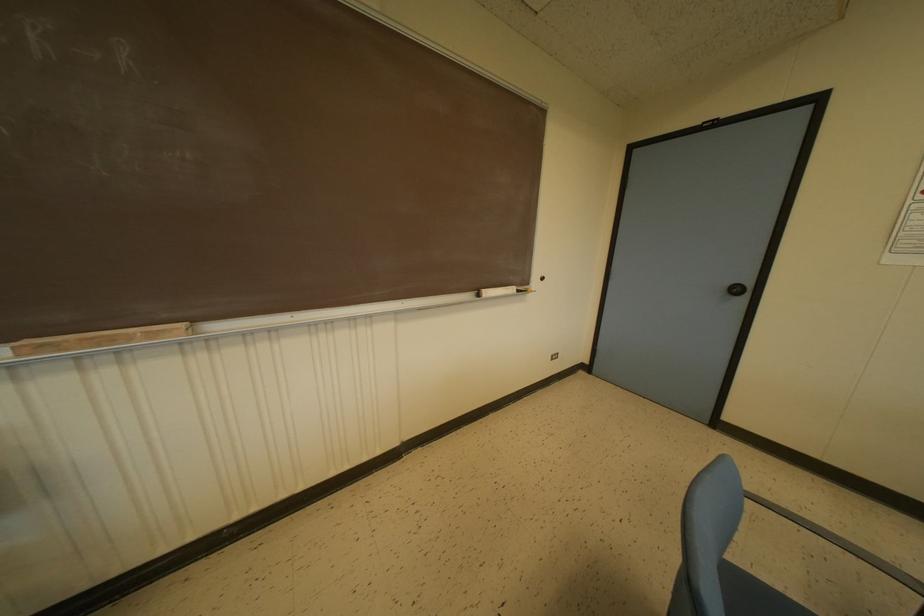
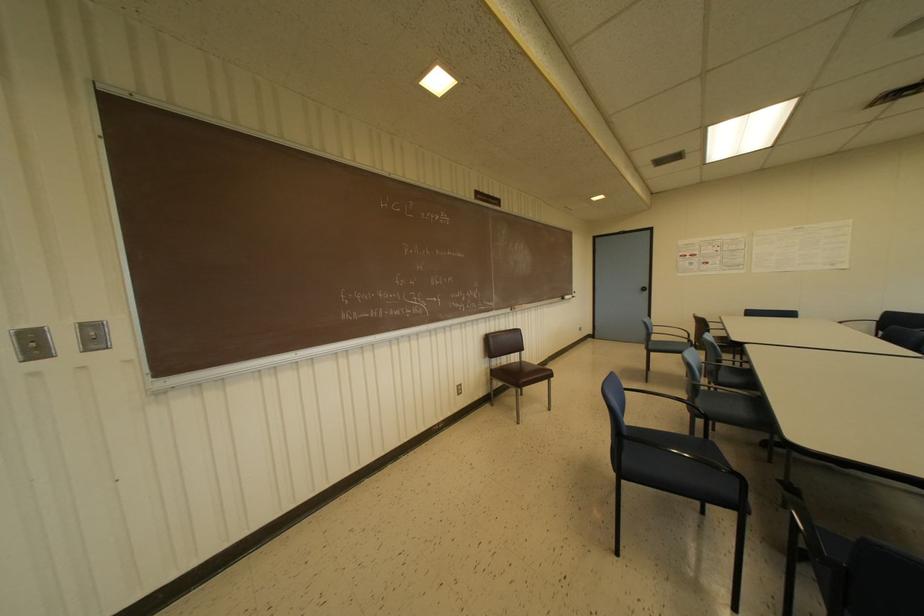
Locate, in the second image, the point that corresponds to pixel 487 292 in the first image.

(565, 296)